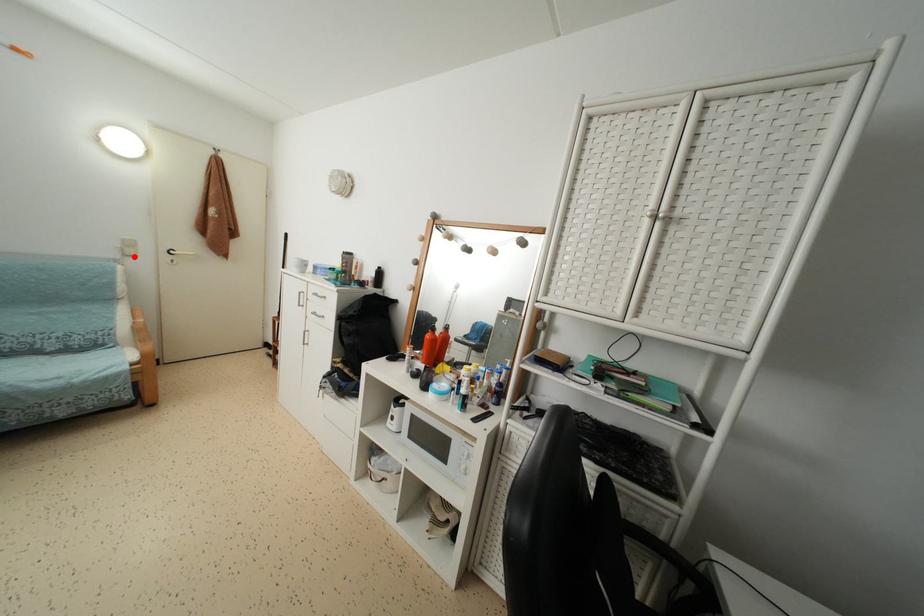
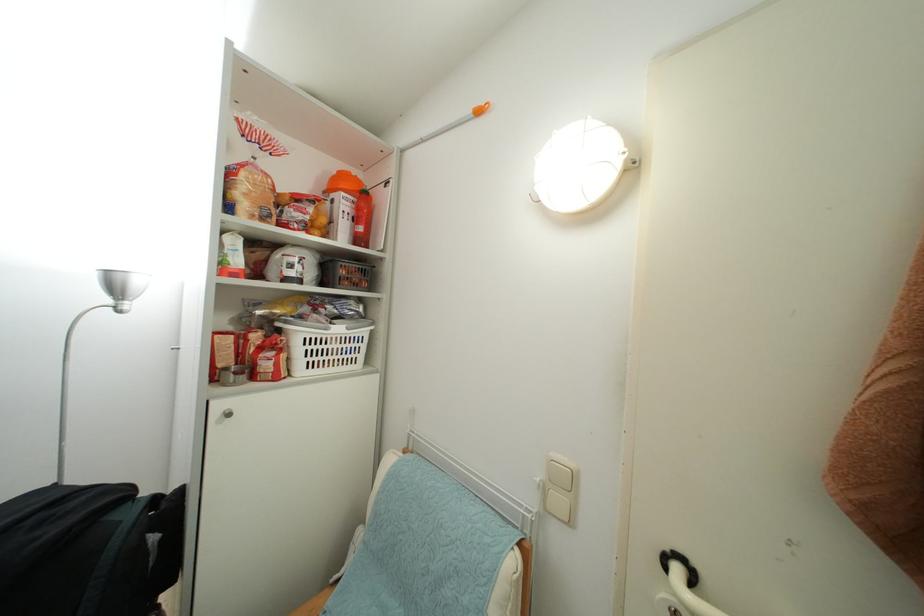
Locate, in the second image, the point that corresponds to the highlighted location in the first image.

(563, 507)